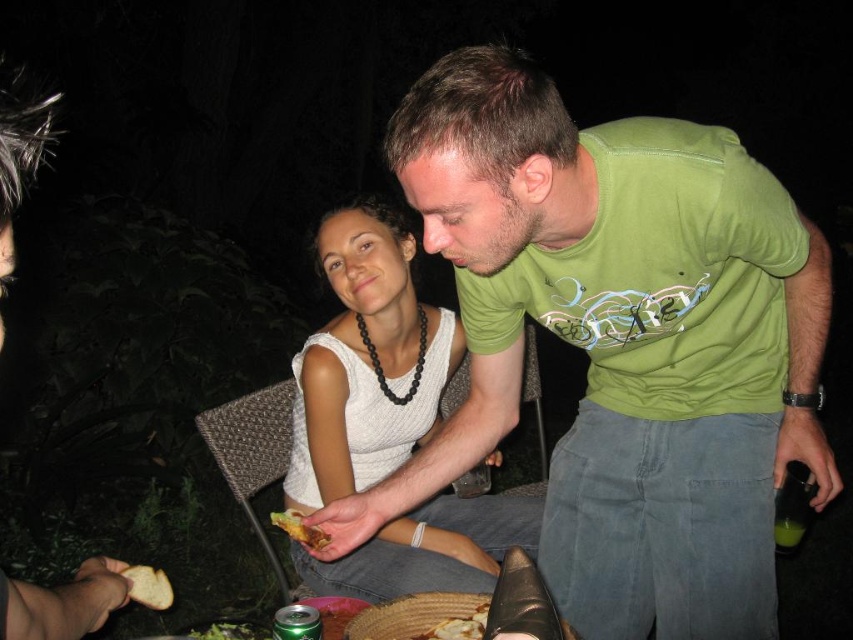
Is white matte tank top at center bigger than golden crispy bread at lower left?

Yes, white matte tank top at center is bigger than golden crispy bread at lower left.

Between white matte tank top at center and golden crispy bread at lower left, which one is positioned lower?

golden crispy bread at lower left

Between point (485, 520) and point (317, 545), which one is positioned in front?

Point (317, 545) is in front.

Locate an element on the screen. This screenshot has width=853, height=640. white matte tank top at center is located at coordinates (366, 362).

Who is positioned more to the left, white matte bread at lower left or green leafy salad at lower center?

From the viewer's perspective, green leafy salad at lower center appears more on the left side.

Does white matte bread at lower left appear on the right side of green leafy salad at lower center?

Indeed, white matte bread at lower left is positioned on the right side of green leafy salad at lower center.

The height and width of the screenshot is (640, 853). In order to click on white matte bread at lower left in this screenshot , I will do `click(148, 586)`.

Identify the location of white matte bread at lower left. (148, 586).

Is green cotton shirt at center in front of golden crispy bread at lower center?

Yes, green cotton shirt at center is closer to the viewer.

Measure the distance between point (x=692, y=355) and camera.

The distance of point (x=692, y=355) from camera is 1.31 meters.

Locate an element on the screen. green cotton shirt at center is located at coordinates pos(619,342).